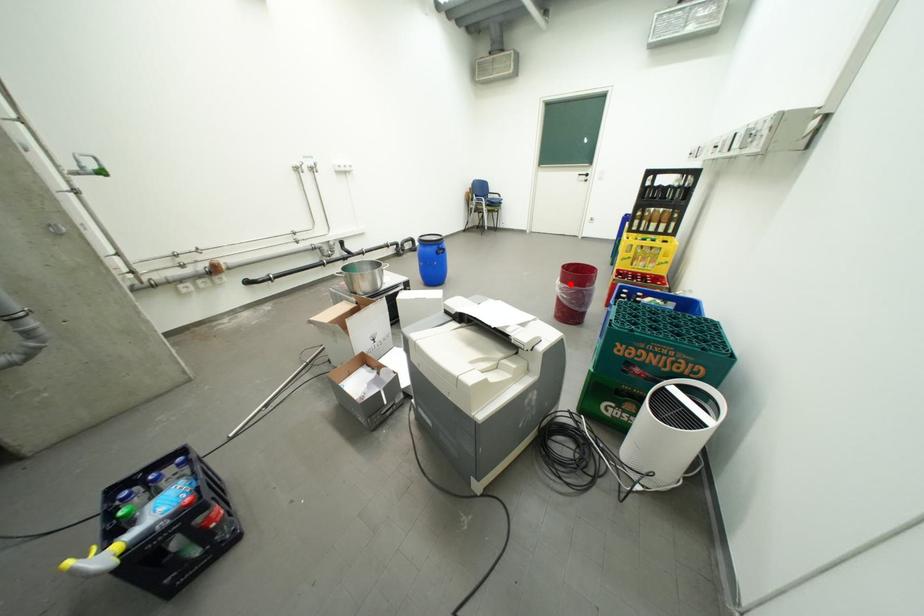
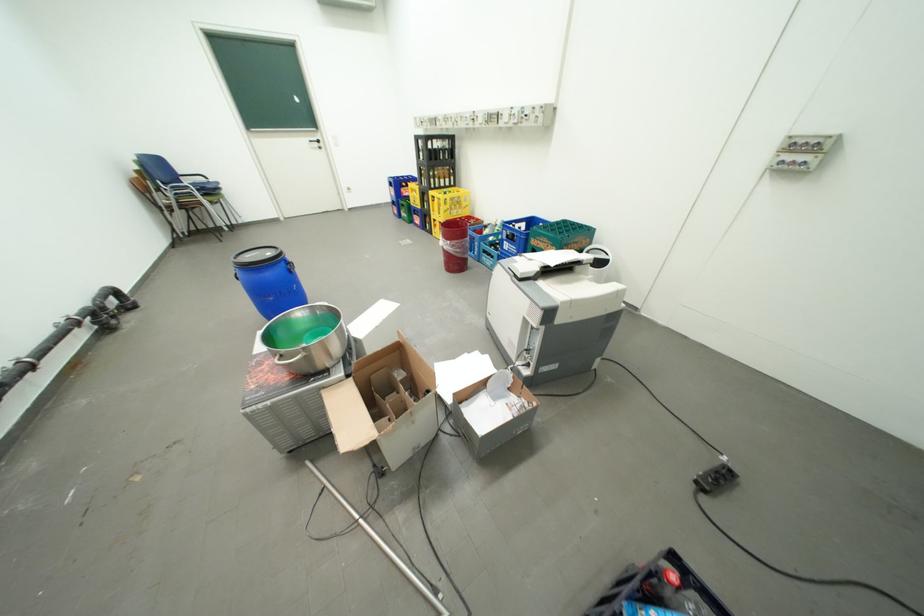
Question: I am providing you with two images of the same scene from different viewpoints. Image1 has a red point marked. In image2, the corresponding 3D location appears at what relative position? Reply with the corresponding letter.

Choices:
 (A) Closer
 (B) Farther

Answer: (A)